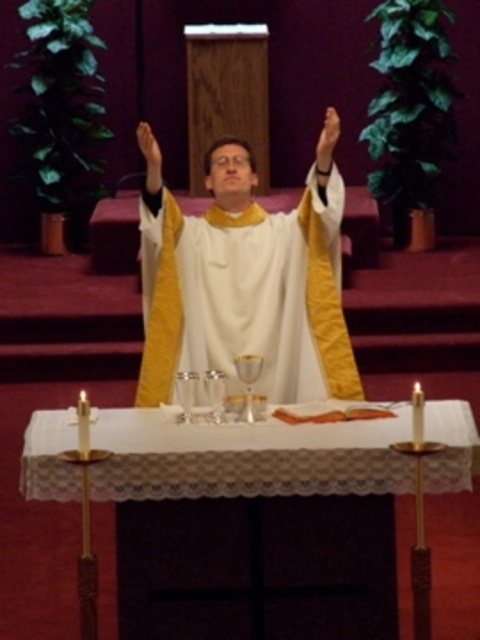
Is white satin robe at center closer to camera compared to white lace tablecloth at center?

No, it is behind white lace tablecloth at center.

Is point (287, 288) closer to camera compared to point (70, 596)?

No, (287, 288) is behind (70, 596).

Find the location of a particular element. white satin robe at center is located at coordinates (245, 278).